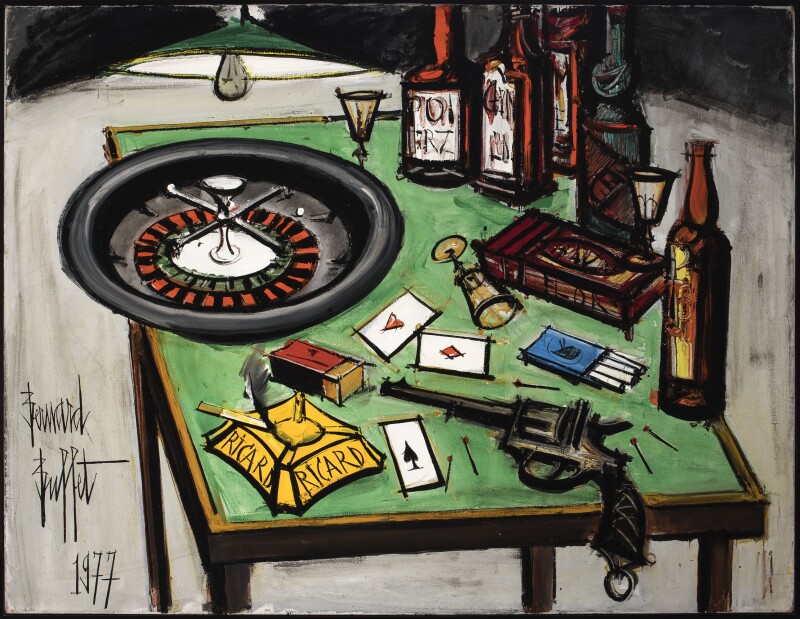
Locate an element on the screen. Image resolution: width=800 pixels, height=619 pixels. table is located at coordinates (222, 488).